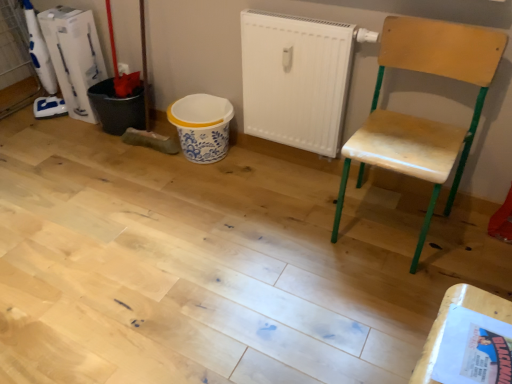
Where is `free point below wooden chair at right (from a real-world perspective)`? The image size is (512, 384). free point below wooden chair at right (from a real-world perspective) is located at coordinates (x=385, y=224).